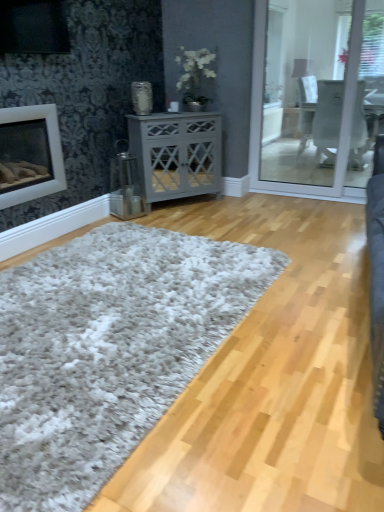
Question: In the image, is white shaggy rug at center positioned in front of or behind gray matte cabinet at center?

Choices:
 (A) behind
 (B) front

Answer: (B)

Question: Considering the relative positions of white shaggy rug at center and gray matte cabinet at center in the image provided, is white shaggy rug at center to the left or to the right of gray matte cabinet at center?

Choices:
 (A) left
 (B) right

Answer: (A)

Question: Based on their relative distances, which object is farther from the gray matte cabinet at center?

Choices:
 (A) white matte fireplace at left
 (B) white shaggy rug at center

Answer: (B)

Question: Which of these objects is positioned farthest from the white shaggy rug at center?

Choices:
 (A) gray matte cabinet at center
 (B) white matte fireplace at left

Answer: (A)